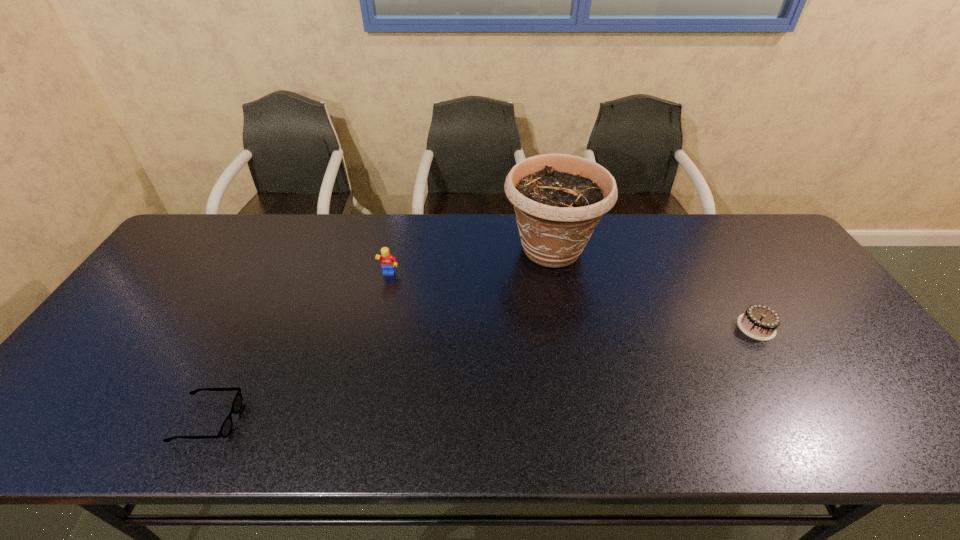
Where is `free space between the rightmost object and the flowerpot`? Image resolution: width=960 pixels, height=540 pixels. free space between the rightmost object and the flowerpot is located at coordinates (654, 288).

Where is `vacant area between the nearest object and the flowerpot`? This screenshot has width=960, height=540. vacant area between the nearest object and the flowerpot is located at coordinates (380, 335).

I want to click on free space that is in between the leftmost object and the second nearest object, so click(x=483, y=374).

Where is `free space between the flowerpot and the Lego`? The image size is (960, 540). free space between the flowerpot and the Lego is located at coordinates (470, 262).

Where is `vacant space that is in between the chocolate cake and the flowerpot`? vacant space that is in between the chocolate cake and the flowerpot is located at coordinates (654, 288).

Find the location of a particular element. vacant point located between the tallest object and the nearest object is located at coordinates (380, 335).

Where is `unoccupied area between the chocolate cake and the third shortest object`? unoccupied area between the chocolate cake and the third shortest object is located at coordinates (573, 301).

You are a GUI agent. You are given a task and a screenshot of the screen. Output one action in this format:
    pyautogui.click(x=<x>, y=<y>)
    Task: Click on the vacant space that's between the third farthest object and the Lego
    
    Given the screenshot: What is the action you would take?
    pyautogui.click(x=573, y=301)

Locate an element on the screen. object that is the second closest to the spectacles is located at coordinates (558, 199).

Locate which object ranks in proximity to the spectacles. Please provide its 2D coordinates. Your answer should be formatted as a tuple, i.e. [(x, y)], where the tuple contains the x and y coordinates of a point satisfying the conditions above.

[(387, 259)]